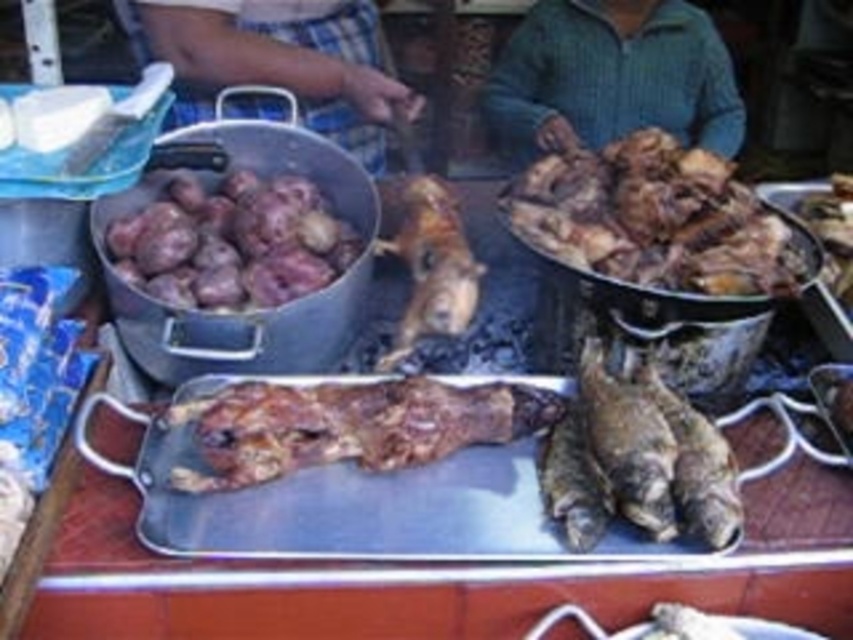
Does brown crispy chicken at upper right have a greater height compared to purple matte potatoes at upper left?

Yes.

Between brown crispy chicken at upper right and purple matte potatoes at upper left, which one has less height?

With less height is purple matte potatoes at upper left.

Who is more forward, (641,193) or (200,285)?

Point (200,285)

This screenshot has width=853, height=640. I want to click on brown crispy chicken at upper right, so click(x=654, y=218).

In order to click on plaid fabric at upper left in this screenshot , I will do `click(283, 61)`.

This screenshot has width=853, height=640. What do you see at coordinates (283, 61) in the screenshot?
I see `plaid fabric at upper left` at bounding box center [283, 61].

Which is in front, point (350, 84) or point (842, 240)?

Point (842, 240) is more forward.

The height and width of the screenshot is (640, 853). Identify the location of plaid fabric at upper left. (283, 61).

Is brown crispy meat at center positioned behind golden brown crispy meat at center?

No, it is not.

Between brown crispy meat at center and golden brown crispy meat at center, which one is positioned lower?

brown crispy meat at center is lower down.

Between point (381, 465) and point (403, 339), which one is positioned behind?

Positioned behind is point (403, 339).

The width and height of the screenshot is (853, 640). I want to click on brown crispy meat at center, so click(347, 426).